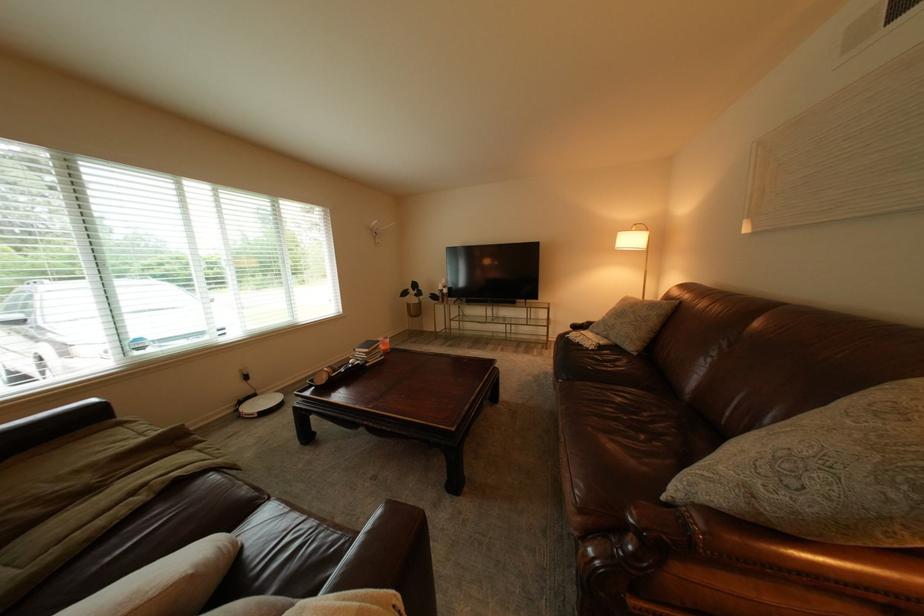
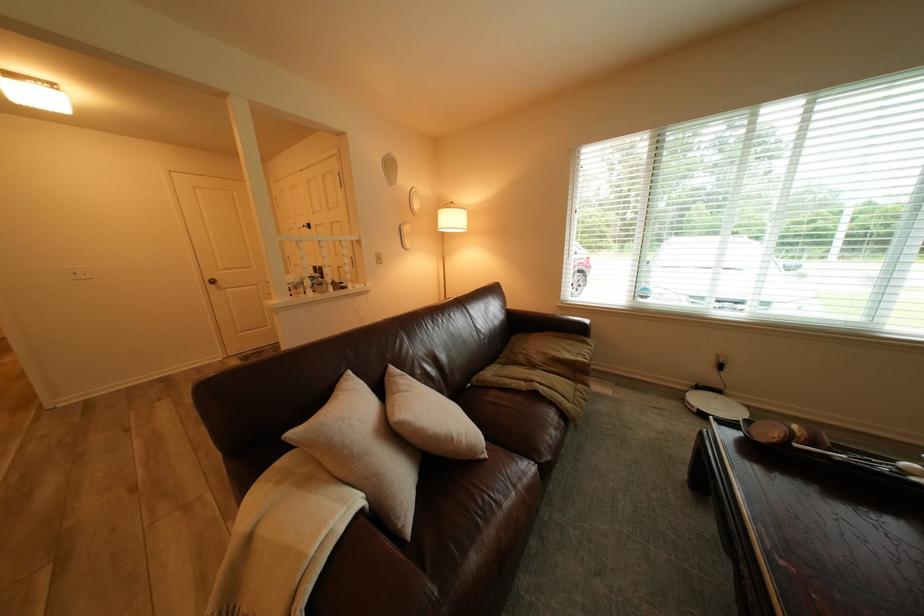
How did the camera likely rotate?

The camera rotated toward left-down.